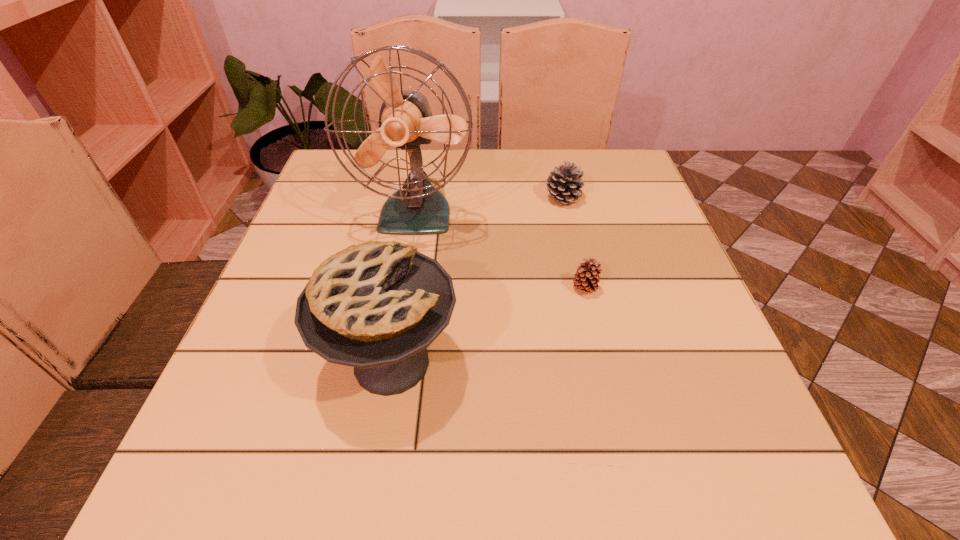
Locate an element on the screen. fan is located at coordinates (405, 121).

This screenshot has height=540, width=960. In order to click on pie in this screenshot , I will do `click(377, 306)`.

The image size is (960, 540). In order to click on the nearest object in this screenshot , I will do `click(377, 306)`.

Locate an element on the screen. This screenshot has height=540, width=960. the farther pinecone is located at coordinates (564, 182).

Where is `the taller pinecone`? This screenshot has height=540, width=960. the taller pinecone is located at coordinates (564, 182).

This screenshot has width=960, height=540. In order to click on the nearer pinecone in this screenshot , I will do `click(586, 279)`.

The image size is (960, 540). What are the coordinates of `the shorter pinecone` in the screenshot? It's located at (586, 279).

Locate an element on the screen. free space located on the front-facing side of the tallest object for air flow is located at coordinates (401, 306).

This screenshot has height=540, width=960. Identify the location of blank space located on the cut side of the nearest object. (684, 363).

In order to click on free spot located on the front of the farther pinecone in this screenshot , I will do `click(590, 320)`.